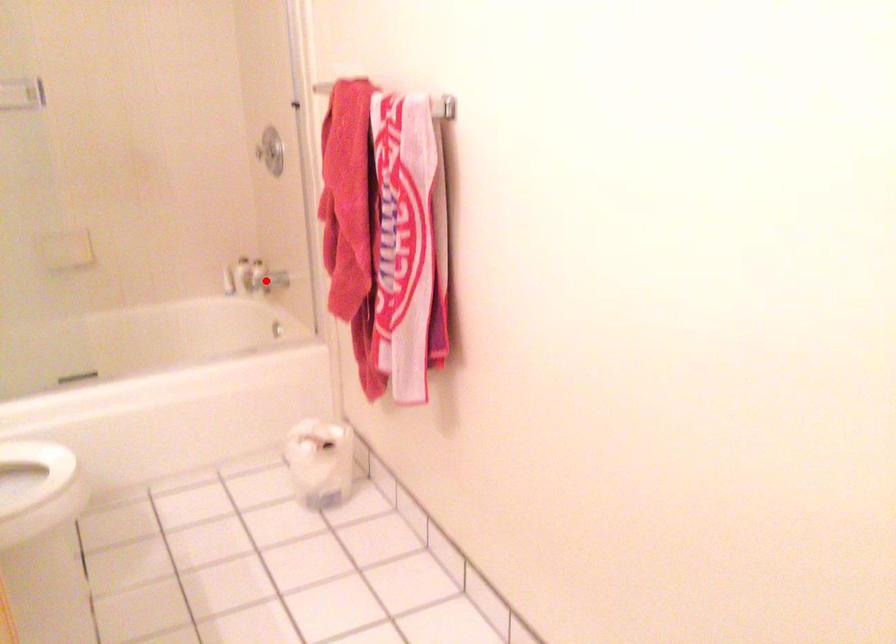
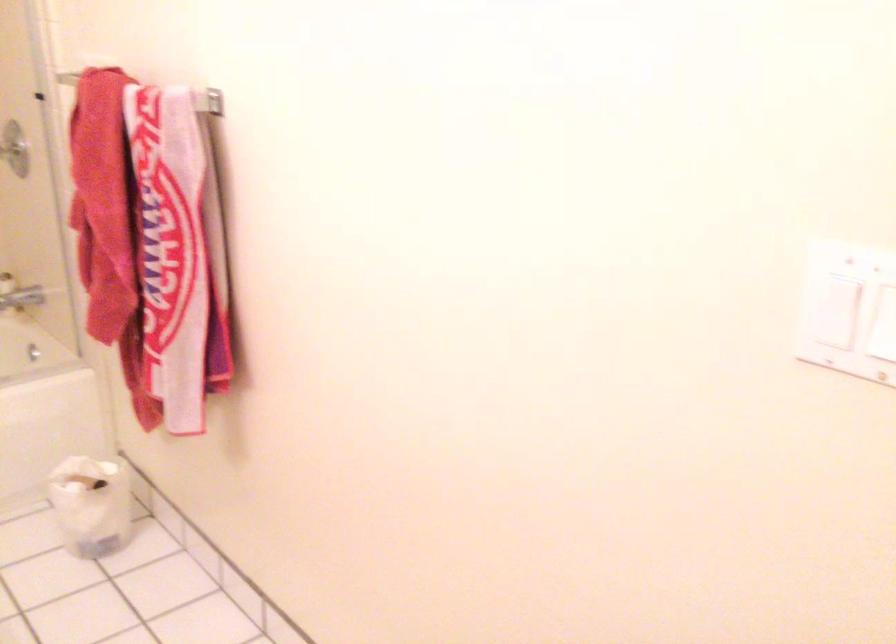
Question: I am providing you with two images of the same scene from different viewpoints. Image1 has a red point marked. In image2, the corresponding 3D location appears at what relative position? Reply with the corresponding letter.

Choices:
 (A) Closer
 (B) Farther

Answer: (A)